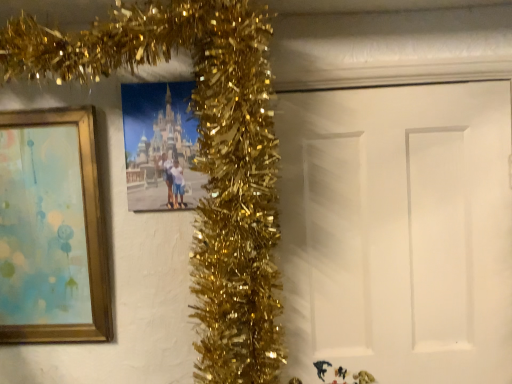
Question: Are gold wood picture frame at left, which is the 1th picture frame from left to right, and matte plastic photo frame at center, positioned as the second picture frame in left-to-right order, far apart?

Choices:
 (A) yes
 (B) no

Answer: (B)

Question: Considering the relative sizes of gold wood picture frame at left, the second picture frame from the right, and matte plastic photo frame at center, positioned as the second picture frame in left-to-right order, in the image provided, is gold wood picture frame at left, the second picture frame from the right, smaller than matte plastic photo frame at center, positioned as the second picture frame in left-to-right order,?

Choices:
 (A) no
 (B) yes

Answer: (A)

Question: Considering the relative sizes of gold wood picture frame at left, the second picture frame from the right, and matte plastic photo frame at center, positioned as the second picture frame in left-to-right order, in the image provided, is gold wood picture frame at left, the second picture frame from the right, taller than matte plastic photo frame at center, positioned as the second picture frame in left-to-right order,?

Choices:
 (A) no
 (B) yes

Answer: (B)

Question: Does gold wood picture frame at left, which is the 1th picture frame from left to right, appear on the left side of matte plastic photo frame at center, positioned as the second picture frame in left-to-right order?

Choices:
 (A) no
 (B) yes

Answer: (B)

Question: Is the depth of gold wood picture frame at left, which is the 1th picture frame from left to right, less than that of matte plastic photo frame at center, which is the 1th picture frame from right to left?

Choices:
 (A) no
 (B) yes

Answer: (B)

Question: From the image's perspective, is gold wood picture frame at left, the second picture frame from the right, located above or below white matte door at center?

Choices:
 (A) above
 (B) below

Answer: (A)

Question: Considering their positions, is gold wood picture frame at left, which is the 1th picture frame from left to right, located in front of or behind white matte door at center?

Choices:
 (A) behind
 (B) front

Answer: (B)

Question: Considering the positions of gold wood picture frame at left, which is the 1th picture frame from left to right, and white matte door at center in the image, is gold wood picture frame at left, which is the 1th picture frame from left to right, bigger or smaller than white matte door at center?

Choices:
 (A) small
 (B) big

Answer: (A)

Question: Considering the positions of point (83, 292) and point (361, 145), is point (83, 292) closer or farther from the camera than point (361, 145)?

Choices:
 (A) closer
 (B) farther

Answer: (B)

Question: In the image, is matte plastic photo frame at center, positioned as the second picture frame in left-to-right order, on the left side or the right side of gold wood picture frame at left, which is the 1th picture frame from left to right?

Choices:
 (A) left
 (B) right

Answer: (B)

Question: Based on their sizes in the image, would you say matte plastic photo frame at center, which is the 1th picture frame from right to left, is bigger or smaller than gold wood picture frame at left, the second picture frame from the right?

Choices:
 (A) small
 (B) big

Answer: (A)

Question: Is matte plastic photo frame at center, positioned as the second picture frame in left-to-right order, spatially inside gold wood picture frame at left, which is the 1th picture frame from left to right, or outside of it?

Choices:
 (A) inside
 (B) outside

Answer: (B)

Question: From their relative heights in the image, would you say matte plastic photo frame at center, positioned as the second picture frame in left-to-right order, is taller or shorter than gold wood picture frame at left, the second picture frame from the right?

Choices:
 (A) short
 (B) tall

Answer: (A)

Question: From their relative heights in the image, would you say white matte door at center is taller or shorter than gold wood picture frame at left, which is the 1th picture frame from left to right?

Choices:
 (A) tall
 (B) short

Answer: (A)

Question: Is white matte door at center wider or thinner than gold wood picture frame at left, which is the 1th picture frame from left to right?

Choices:
 (A) thin
 (B) wide

Answer: (A)